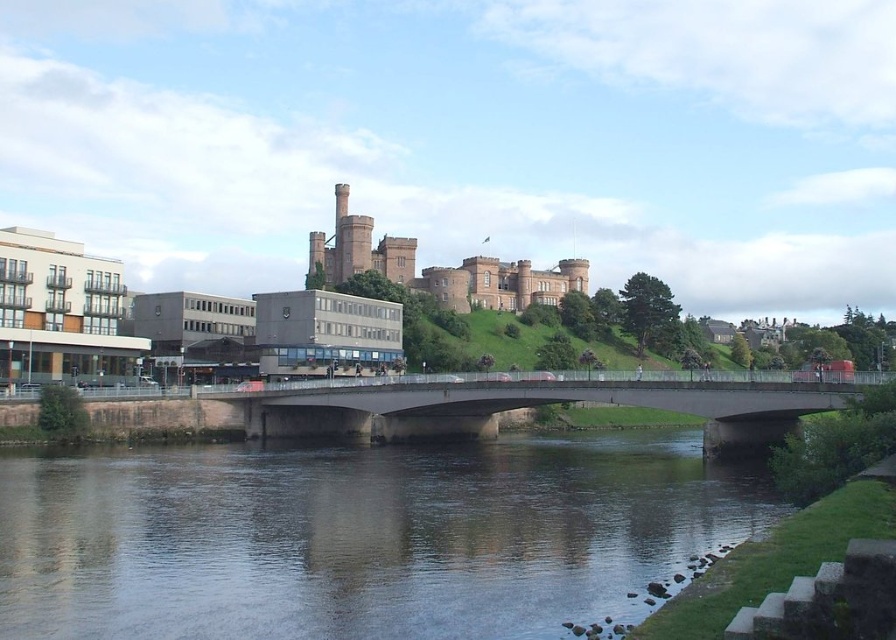
You are a tourist standing on the hill near the historic castle. You want to take a photo that includes both the dark gray water at center and the concrete bridge at center. Which object should appear lower in the photo?

The dark gray water at center should appear lower in the photo because it is not as tall as the concrete bridge at center.

You are a tourist standing on the grassy hill near the historic castle. You want to take a photo that includes both the dark gray water at center and the concrete bridge at center. Which object should you position lower in your camera frame to ensure both are visible?

You should position the dark gray water at center lower in your camera frame since it is located below the concrete bridge at center, allowing both to be visible in the photo.